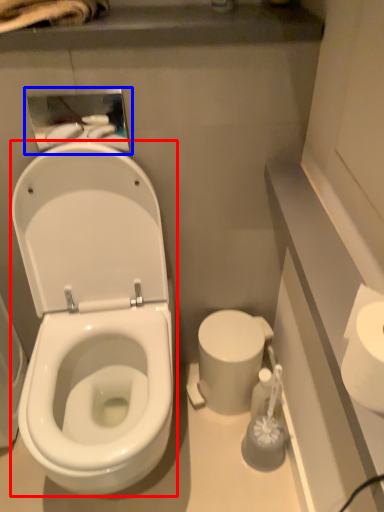
Question: Which object appears closest to the camera in this image, wide (highlighted by a red box) or medicine cabinet (highlighted by a blue box)?

Choices:
 (A) wide
 (B) medicine cabinet

Answer: (A)